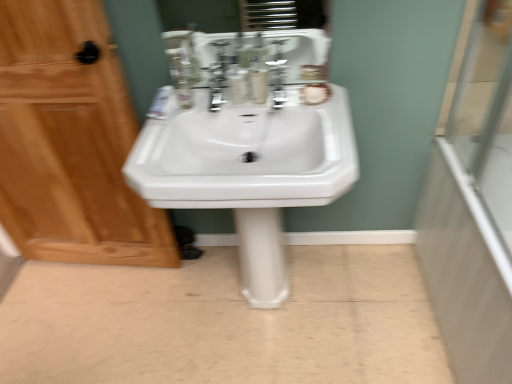
You are a GUI agent. You are given a task and a screenshot of the screen. Output one action in this format:
    pyautogui.click(x=<x>, y=<y>)
    Task: Click on the free spot above white glossy pedestal sink at center (from a real-world perspective)
    The width and height of the screenshot is (512, 384).
    Given the screenshot: What is the action you would take?
    pyautogui.click(x=204, y=309)